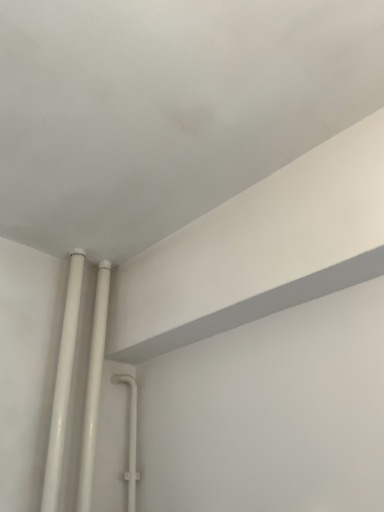
Question: Should I look upward or downward to see white glossy pipes at lower left, the first pipe when ordered from right to left?

Choices:
 (A) up
 (B) down

Answer: (B)

Question: Does white glossy pipes at lower left, arranged as the first pipe when viewed from the left, have a smaller size compared to white glossy pipes at lower left, the first pipe when ordered from right to left?

Choices:
 (A) yes
 (B) no

Answer: (A)

Question: Is the depth of white glossy pipes at lower left, arranged as the first pipe when viewed from the left, less than that of white glossy pipes at lower left, which ranks as the second pipe in left-to-right order?

Choices:
 (A) no
 (B) yes

Answer: (B)

Question: Is white glossy pipes at lower left, arranged as the first pipe when viewed from the left, wider than white glossy pipes at lower left, the first pipe when ordered from right to left?

Choices:
 (A) no
 (B) yes

Answer: (A)

Question: Is white glossy pipes at lower left, arranged as the first pipe when viewed from the left, at the left side of white glossy pipes at lower left, the first pipe when ordered from right to left?

Choices:
 (A) no
 (B) yes

Answer: (B)

Question: Is white glossy pipes at lower left, the second pipe in the right-to-left sequence, at the right side of white glossy pipes at lower left, the first pipe when ordered from right to left?

Choices:
 (A) no
 (B) yes

Answer: (A)

Question: From a real-world perspective, is white glossy pipes at lower left, arranged as the first pipe when viewed from the left, below white glossy pipes at lower left, the first pipe when ordered from right to left?

Choices:
 (A) no
 (B) yes

Answer: (A)

Question: Is white glossy pipes at lower left, the first pipe when ordered from right to left, smaller than white glossy pipes at lower left, the second pipe in the right-to-left sequence?

Choices:
 (A) no
 (B) yes

Answer: (A)

Question: From a real-world perspective, is white glossy pipes at lower left, the first pipe when ordered from right to left, located higher than white glossy pipes at lower left, the second pipe in the right-to-left sequence?

Choices:
 (A) yes
 (B) no

Answer: (B)

Question: Considering the relative sizes of white glossy pipes at lower left, which ranks as the second pipe in left-to-right order, and white glossy pipes at lower left, the second pipe in the right-to-left sequence, in the image provided, is white glossy pipes at lower left, which ranks as the second pipe in left-to-right order, bigger than white glossy pipes at lower left, the second pipe in the right-to-left sequence,?

Choices:
 (A) no
 (B) yes

Answer: (B)

Question: Is white glossy pipes at lower left, which ranks as the second pipe in left-to-right order, wider than white glossy pipes at lower left, arranged as the first pipe when viewed from the left?

Choices:
 (A) no
 (B) yes

Answer: (B)

Question: Does white glossy pipes at lower left, which ranks as the second pipe in left-to-right order, have a greater height compared to white glossy pipes at lower left, arranged as the first pipe when viewed from the left?

Choices:
 (A) no
 (B) yes

Answer: (B)

Question: From the image's perspective, does white glossy pipes at lower left, which ranks as the second pipe in left-to-right order, appear higher than white glossy pipes at lower left, the second pipe in the right-to-left sequence?

Choices:
 (A) yes
 (B) no

Answer: (B)

Question: Considering their positions, is white glossy pipes at lower left, the second pipe in the right-to-left sequence, located in front of or behind white glossy pipes at lower left, the first pipe when ordered from right to left?

Choices:
 (A) front
 (B) behind

Answer: (A)